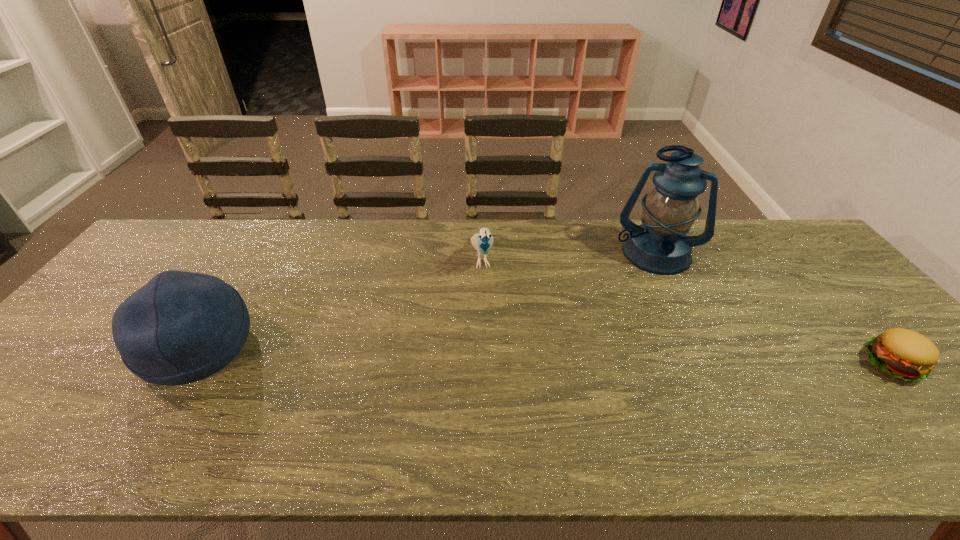
The width and height of the screenshot is (960, 540). I want to click on skullcap, so click(x=181, y=327).

I want to click on the second tallest object, so click(181, 327).

At what (x,y) coordinates should I click in order to perform the action: click on hamburger. Please return your answer as a coordinate pair (x, y). Looking at the image, I should click on (903, 354).

Identify the location of the shortest object. (903, 354).

The image size is (960, 540). I want to click on the third tallest object, so click(482, 242).

Identify the location of the third object from right to left. (482, 242).

You are a GUI agent. You are given a task and a screenshot of the screen. Output one action in this format:
    pyautogui.click(x=<x>, y=<y>)
    Task: Click on the second object from right to left
    This screenshot has width=960, height=540.
    Given the screenshot: What is the action you would take?
    pyautogui.click(x=659, y=245)

At what (x,y) coordinates should I click in order to perform the action: click on lantern. Please return your answer as a coordinate pair (x, y). Looking at the image, I should click on (659, 245).

Locate an element on the screen. free location located on the right of the leftmost object is located at coordinates (377, 346).

This screenshot has height=540, width=960. I want to click on vacant space located on the back of the rightmost object, so click(794, 253).